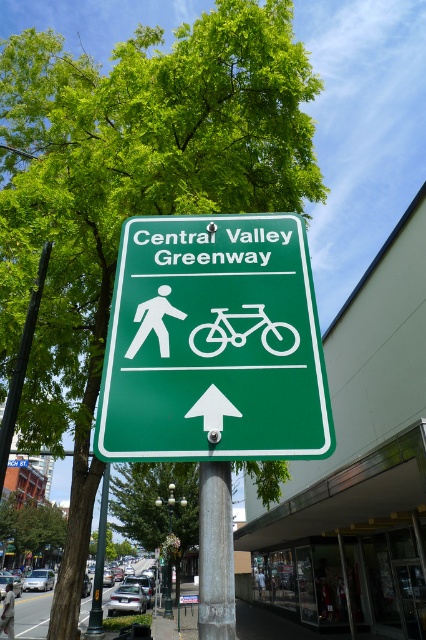
Question: Does white matte bicycle at center lie behind metallic pole at lower left?

Choices:
 (A) no
 (B) yes

Answer: (A)

Question: Is gray metallic pole at center to the left of white plastic pedestrian at upper center from the viewer's perspective?

Choices:
 (A) no
 (B) yes

Answer: (B)

Question: Which is nearer to the light brown leather jacket at upper center?

Choices:
 (A) green matte sign at upper center
 (B) metallic silver bike lane at lower left

Answer: (B)

Question: Which of the following is the closest to the observer?

Choices:
 (A) white matte bicycle at center
 (B) light brown leather jacket at upper center
 (C) green matte sign at upper center

Answer: (C)

Question: Which point is farther to the camera?

Choices:
 (A) green leafy tree at upper left
 (B) white matte bicycle at center

Answer: (A)

Question: Does gray metallic pole at center have a greater width compared to metallic pole at lower left?

Choices:
 (A) yes
 (B) no

Answer: (B)